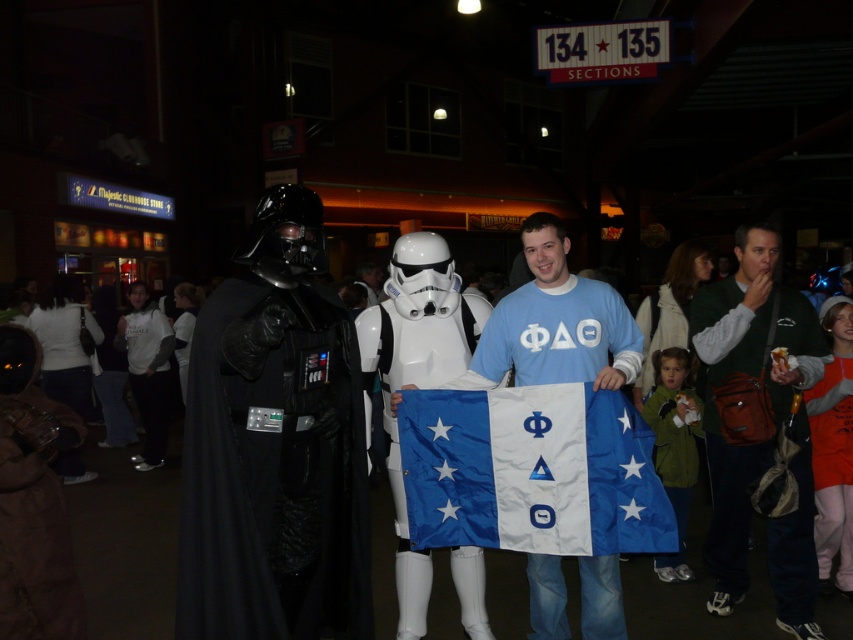
Question: Estimate the real-world distances between objects in this image. Which object is closer to the white plastic stormtrooper at center?

Choices:
 (A) white matte hoodie at center
 (B) green fabric jacket at right

Answer: (B)

Question: Based on their relative distances, which object is nearer to the blue fabric flag at center?

Choices:
 (A) orange fleece sweatshirt at lower right
 (B) white matte hoodie at center
 (C) light blue cotton t-shirt at center
 (D) black leather suit at left

Answer: (C)

Question: Can you confirm if green fabric jacket at right is wider than light blue cotton t-shirt at center?

Choices:
 (A) no
 (B) yes

Answer: (A)

Question: Is blue fabric flag at center to the right of orange fleece sweatshirt at lower right from the viewer's perspective?

Choices:
 (A) no
 (B) yes

Answer: (A)

Question: Does black leather suit at left appear over white matte hoodie at center?

Choices:
 (A) yes
 (B) no

Answer: (B)

Question: Which of the following is the farthest from the observer?

Choices:
 (A) green fabric jacket at right
 (B) black leather suit at left

Answer: (A)